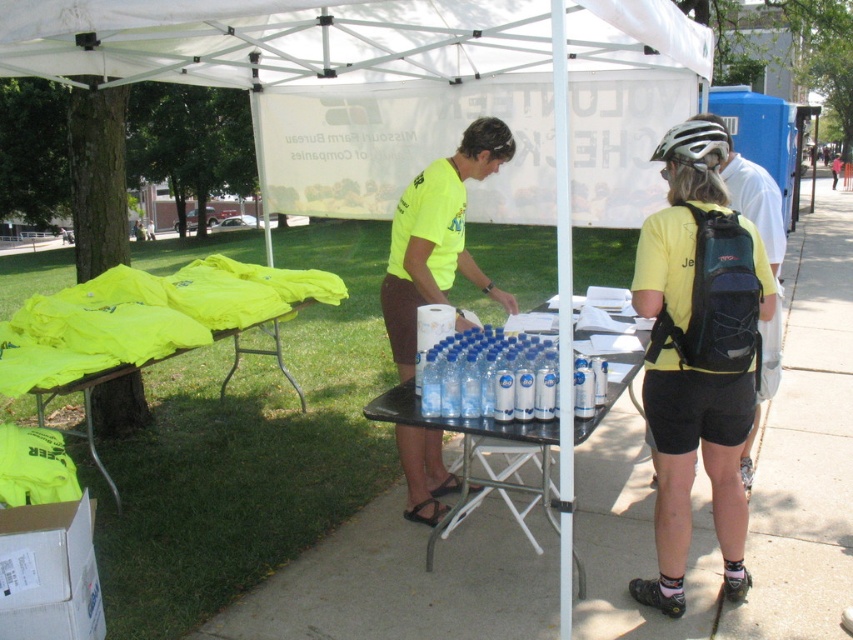
Question: Which point is farther to the camera?

Choices:
 (A) (711, 125)
 (B) (766, 342)
 (C) (254, 285)
 (D) (694, 348)

Answer: (C)

Question: Based on their relative distances, which object is nearer to the neon yellow fabric at left?

Choices:
 (A) yellow matte shirt at center
 (B) white matte bicycle helmet at upper right
 (C) clear plastic bottles at center

Answer: (C)

Question: Is yellow matte shirt at center thinner than neon yellow fabric at left?

Choices:
 (A) no
 (B) yes

Answer: (B)

Question: Can you confirm if yellow matte shirt at center is positioned above neon yellow fabric at left?

Choices:
 (A) no
 (B) yes

Answer: (B)

Question: Can you confirm if black rubber table at center is positioned to the right of neon yellow fabric at left?

Choices:
 (A) no
 (B) yes

Answer: (B)

Question: Which object is the farthest from the matte black backpack at right?

Choices:
 (A) neon yellow fabric at left
 (B) clear plastic bottles at center
 (C) yellow matte shirt at center

Answer: (A)